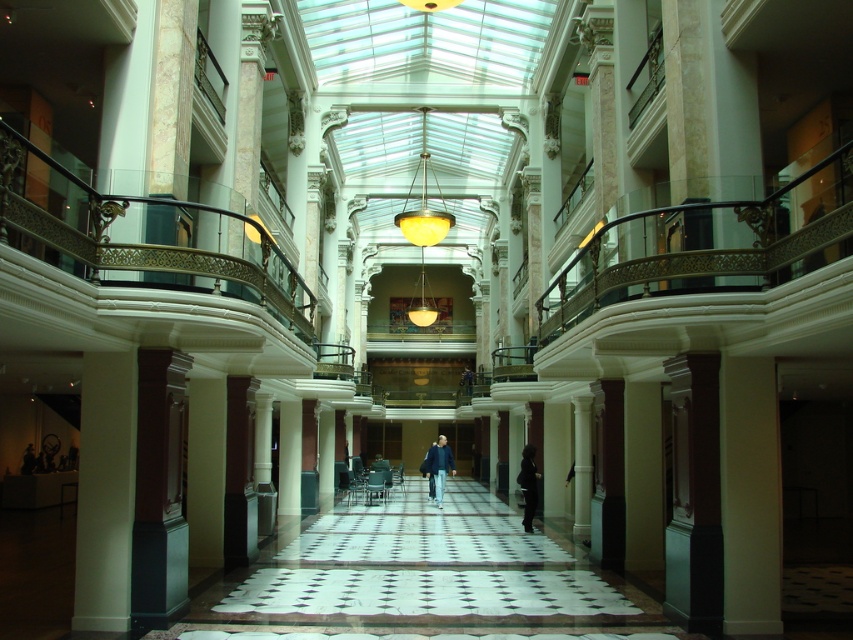
Who is positioned more to the left, blue denim jacket at center or dark gray fabric coat at center?

Positioned to the left is blue denim jacket at center.

Who is more distant from viewer, (433,492) or (527,470)?

Positioned behind is point (433,492).

I want to click on blue denim jacket at center, so click(438, 467).